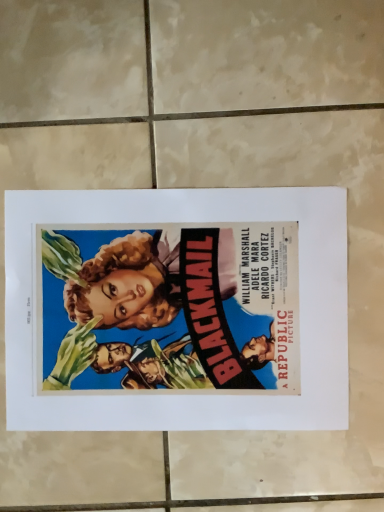
Describe the element at coordinates (176, 309) in the screenshot. I see `matte paper poster at center` at that location.

Find the location of a particular element. matte paper poster at center is located at coordinates (176, 309).

I want to click on matte paper poster at center, so click(x=176, y=309).